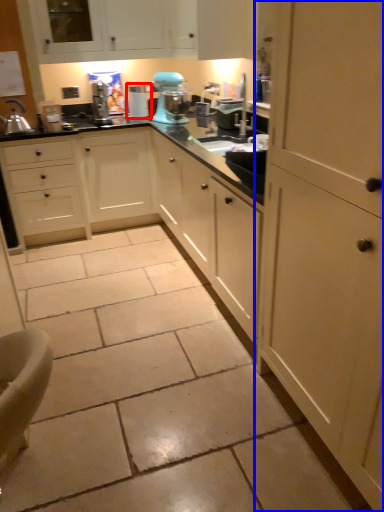
Question: Among these objects, which one is farthest to the camera, coffee machine (highlighted by a red box) or cabinetry (highlighted by a blue box)?

Choices:
 (A) coffee machine
 (B) cabinetry

Answer: (A)